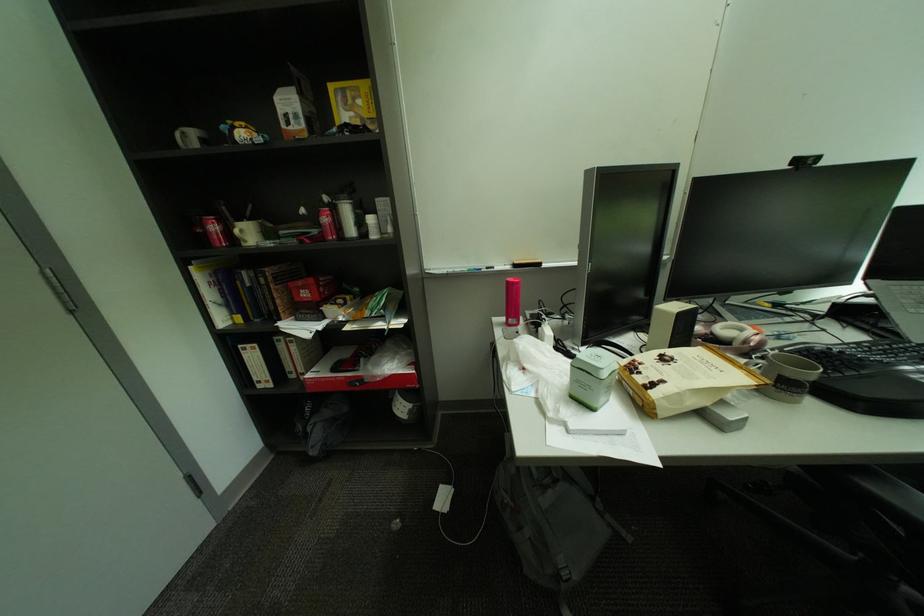
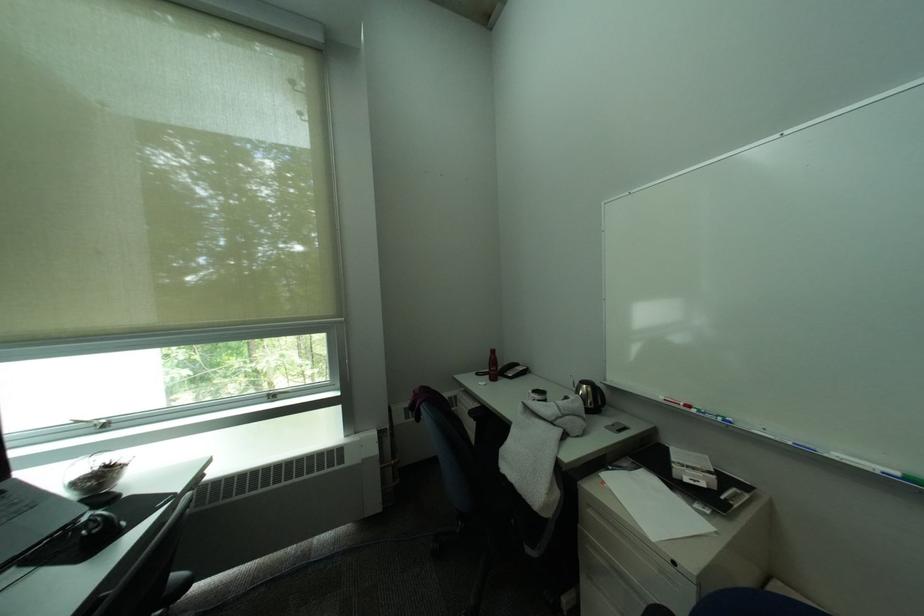
Question: Based on the continuous images, in which direction is the camera rotating? Reply with the corresponding letter.

Choices:
 (A) Left
 (B) Right
 (C) Up
 (D) Down

Answer: (B)